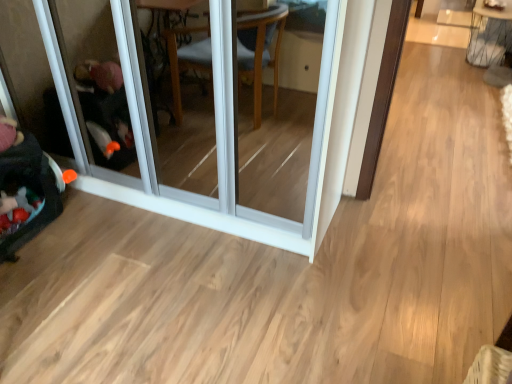
Where is `vacant area that is in front of transparent glass screen door at left`? The height and width of the screenshot is (384, 512). vacant area that is in front of transparent glass screen door at left is located at coordinates (179, 289).